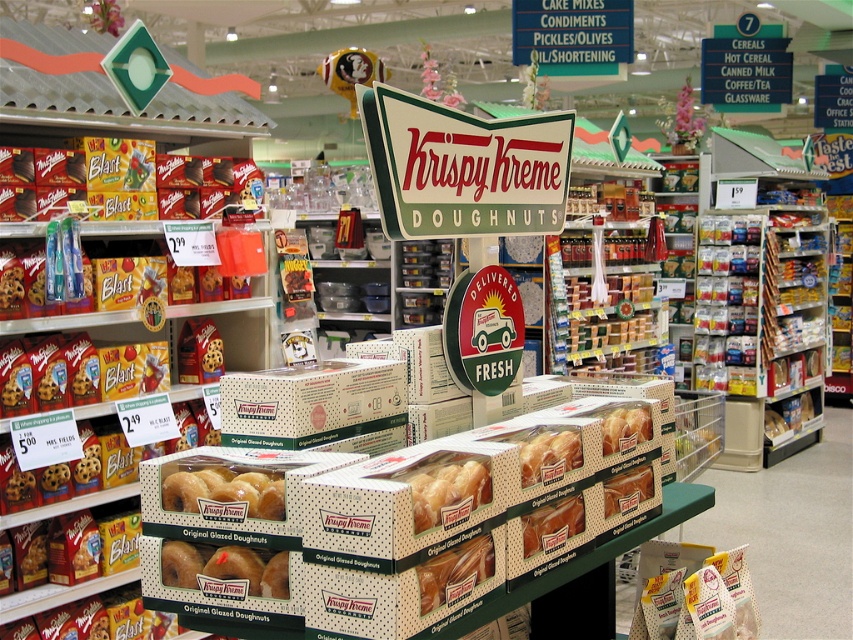
You are a store employee who needs to place a 10 inch wide promotional banner between the white dotted cardboard box at center and the matte glazed donut at center. Will there be enough space?

The distance between the white dotted cardboard box at center and the matte glazed donut at center is 9.10 inches, which is less than the 10 inch width of the banner. Therefore, the banner cannot be placed between them without overlapping.

You are a customer looking to grab a golden glazed doughnut at center from the display. The white dotted cardboard box at center is blocking your path. Can you reach the doughnut without moving the box?

The golden glazed doughnut at center is behind the white dotted cardboard box at center, so you cannot reach it without moving the box.